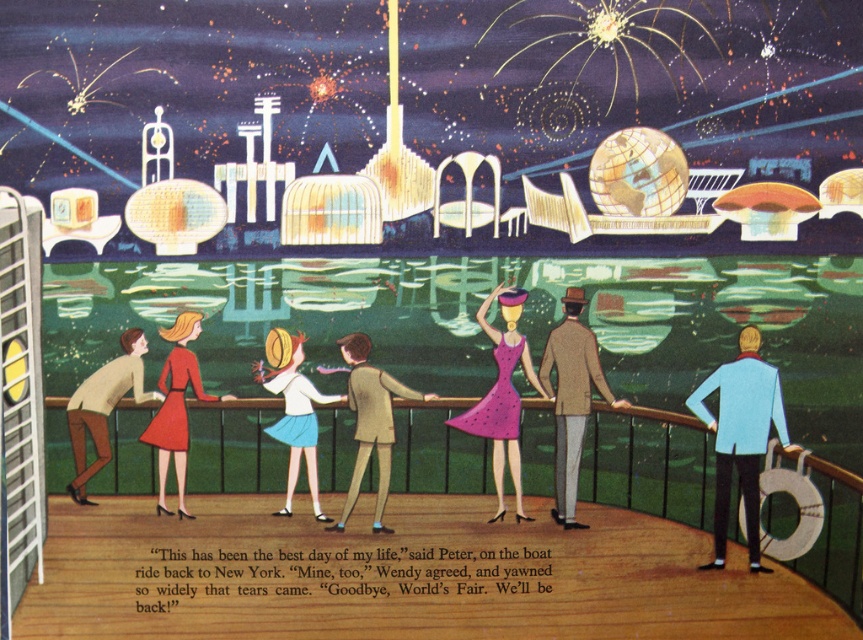
Question: Is metallic brown railing at center above matte red dress at lower left?

Choices:
 (A) no
 (B) yes

Answer: (A)

Question: Is light brown wool coat at center to the right of light blue fabric skirt at center from the viewer's perspective?

Choices:
 (A) yes
 (B) no

Answer: (A)

Question: Based on their relative distances, which object is farther from the light brown sweater at left?

Choices:
 (A) light brown wool coat at center
 (B) light brown suit at center
 (C) purple dotted dress at center
 (D) metallic brown railing at center

Answer: (A)

Question: Based on their relative distances, which object is farther from the light blue fabric jacket at right?

Choices:
 (A) light brown wool coat at center
 (B) matte red dress at lower left
 (C) light blue fabric skirt at center

Answer: (B)

Question: Can you confirm if light brown wool coat at center is positioned below matte red dress at lower left?

Choices:
 (A) no
 (B) yes

Answer: (A)

Question: Among these points, which one is nearest to the camera?

Choices:
 (A) (697, 474)
 (B) (389, 432)

Answer: (B)